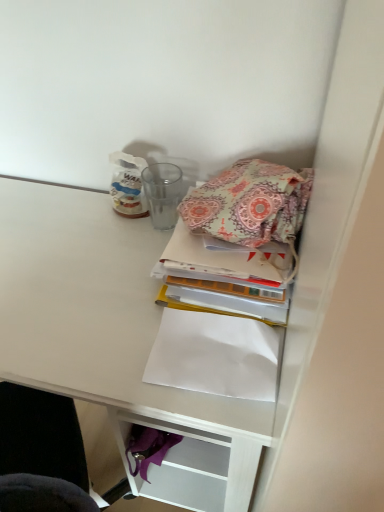
Find the location of a particular element. This screenshot has height=512, width=384. white matte desk at upper right is located at coordinates (112, 338).

What do you see at coordinates (250, 203) in the screenshot? I see `patterned fabric bag at upper right` at bounding box center [250, 203].

Image resolution: width=384 pixels, height=512 pixels. In order to click on white matte desk at upper right in this screenshot , I will do click(112, 338).

Is point (220, 194) behind point (177, 478)?

No, (220, 194) is closer to viewer.

Based on the photo, which is correct: patterned fabric bag at upper right is inside white matte desk at upper right, or outside of it?

patterned fabric bag at upper right exists outside the volume of white matte desk at upper right.

Is patterned fabric bag at upper right wider than white matte desk at upper right?

In fact, patterned fabric bag at upper right might be narrower than white matte desk at upper right.

Does patterned fabric bag at upper right have a larger size compared to white matte desk at upper right?

No.

Considering the relative positions of white matte desk at upper right and paisley fabric book at center in the image provided, is white matte desk at upper right behind paisley fabric book at center?

No.

In the image, there is a paisley fabric book at center. Where is `shelf below it (from a real-world perspective)`? The height and width of the screenshot is (512, 384). shelf below it (from a real-world perspective) is located at coordinates (112, 338).

From the image's perspective, is white matte desk at upper right over paisley fabric book at center?

Actually, white matte desk at upper right appears below paisley fabric book at center in the image.

Looking at this image, which is less distant, (261,290) or (219,400)?

Point (261,290) is farther from the camera than point (219,400).

Who is shorter, paisley fabric book at center or white matte desk at upper right?

paisley fabric book at center is shorter.

There is a white matte desk at upper right. Identify the location of book above it (from a real-world perspective). This screenshot has height=512, width=384. (225, 276).

From a real-world perspective, does paisley fabric book at center stand above white matte desk at upper right?

Yes, from a real-world perspective, paisley fabric book at center is on top of white matte desk at upper right.

From a real-world perspective, is white matte desk at upper right over patterned fabric bag at upper right?

No, from a real-world perspective, white matte desk at upper right is not over patterned fabric bag at upper right

Can you confirm if white matte desk at upper right is thinner than patterned fabric bag at upper right?

No.

Does point (108, 376) come behind point (281, 226)?

No.

Does point (189, 455) lie in front of point (193, 343)?

No.

Who is smaller, white matte desk at upper right or white paper at lower center?

With smaller size is white paper at lower center.

Considering the sizes of objects white matte desk at upper right and white paper at lower center in the image provided, who is taller, white matte desk at upper right or white paper at lower center?

With more height is white matte desk at upper right.

From their relative heights in the image, would you say patterned fabric bag at upper right is taller or shorter than white paper at lower center?

In the image, patterned fabric bag at upper right appears to be taller than white paper at lower center.

Looking at this image, considering the relative sizes of patterned fabric bag at upper right and white paper at lower center in the image provided, is patterned fabric bag at upper right wider than white paper at lower center?

Yes, patterned fabric bag at upper right is wider than white paper at lower center.

Is patterned fabric bag at upper right facing towards white paper at lower center?

No.

Would you say white paper at lower center is part of patterned fabric bag at upper right's contents?

Actually, white paper at lower center is outside patterned fabric bag at upper right.

Does paisley fabric book at center touch patterned fabric bag at upper right?

Yes, paisley fabric book at center is beside patterned fabric bag at upper right.

Locate an element on the screen. The height and width of the screenshot is (512, 384). cloth above the paisley fabric book at center (from the image's perspective) is located at coordinates (250, 203).

From a real-world perspective, between paisley fabric book at center and patterned fabric bag at upper right, who is vertically lower?

From a 3D spatial view, paisley fabric book at center is below.

You are a GUI agent. You are given a task and a screenshot of the screen. Output one action in this format:
    pyautogui.click(x=<x>, y=<y>)
    Task: Click on the shelf on the left of patterned fabric bag at upper right
    The width and height of the screenshot is (384, 512).
    Given the screenshot: What is the action you would take?
    pyautogui.click(x=112, y=338)

You are a GUI agent. You are given a task and a screenshot of the screen. Output one action in this format:
    pyautogui.click(x=<x>, y=<y>)
    Task: Click on the shelf below the paisley fabric book at center (from the image's perspective)
    
    Given the screenshot: What is the action you would take?
    coord(112,338)

When comparing their distances from patterned fabric bag at upper right, does white paper at lower center or white matte desk at upper right seem closer?

Based on the image, white paper at lower center appears to be nearer to patterned fabric bag at upper right.

Considering their positions, is white paper at lower center positioned further to white matte desk at upper right than paisley fabric book at center?

The object further to white matte desk at upper right is paisley fabric book at center.

In the scene shown: Considering their positions, is paisley fabric book at center positioned closer to white paper at lower center than white matte desk at upper right?

Among the two, paisley fabric book at center is located nearer to white paper at lower center.

Which object lies nearer to the anchor point white matte desk at upper right, paisley fabric book at center or white paper at lower center?

The object closer to white matte desk at upper right is white paper at lower center.

Considering their positions, is white paper at lower center positioned closer to paisley fabric book at center than patterned fabric bag at upper right?

patterned fabric bag at upper right is closer to paisley fabric book at center.

Looking at this image, when comparing their distances from paisley fabric book at center, does patterned fabric bag at upper right or white paper at lower center seem closer?

The object closer to paisley fabric book at center is patterned fabric bag at upper right.

From the image, which object appears to be nearer to patterned fabric bag at upper right, paisley fabric book at center or white matte desk at upper right?

paisley fabric book at center.

From the image, which object appears to be farther from paisley fabric book at center, white matte desk at upper right or patterned fabric bag at upper right?

white matte desk at upper right.

I want to click on book that lies between patterned fabric bag at upper right and white paper at lower center from top to bottom, so click(225, 276).

You are a GUI agent. You are given a task and a screenshot of the screen. Output one action in this format:
    pyautogui.click(x=<x>, y=<y>)
    Task: Click on the notebook between patterned fabric bag at upper right and white matte desk at upper right vertically
    
    Given the screenshot: What is the action you would take?
    pyautogui.click(x=215, y=355)

What are the coordinates of `book between patterned fabric bag at upper right and white matte desk at upper right from top to bottom` in the screenshot? It's located at (225, 276).

Locate an element on the screen. The height and width of the screenshot is (512, 384). notebook situated between white matte desk at upper right and paisley fabric book at center from left to right is located at coordinates (215, 355).